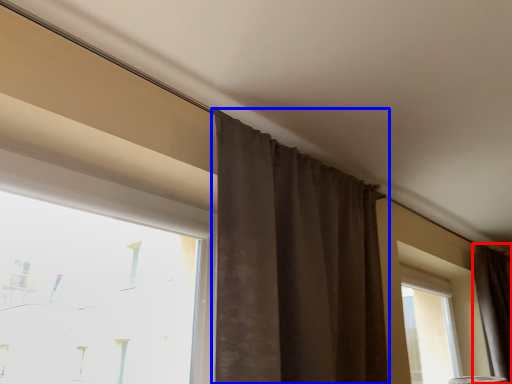
Question: Which of the following is the closest to the observer, curtain (highlighted by a red box) or curtain (highlighted by a blue box)?

Choices:
 (A) curtain
 (B) curtain

Answer: (B)